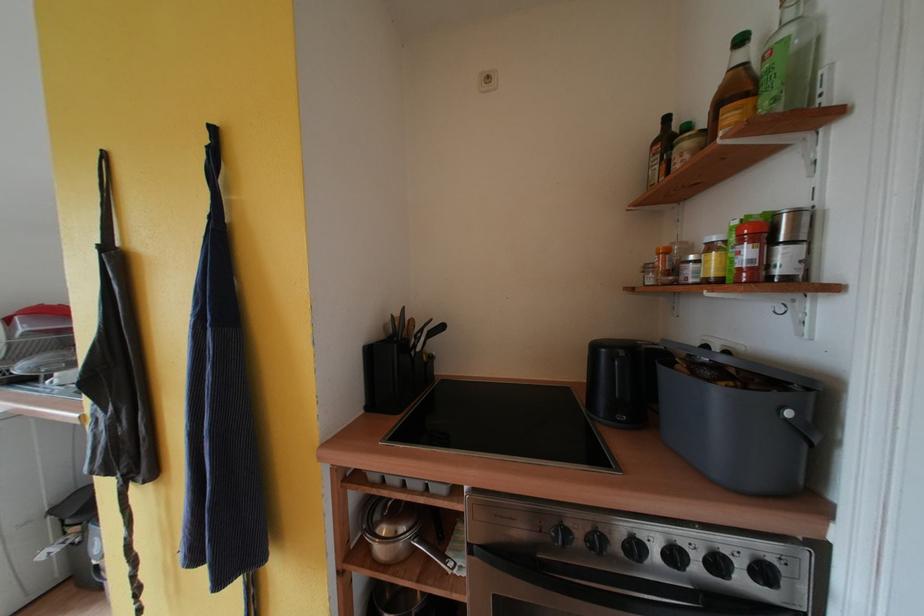
Image resolution: width=924 pixels, height=616 pixels. What are the coordinates of `knife handle` in the screenshot? It's located at (433, 331).